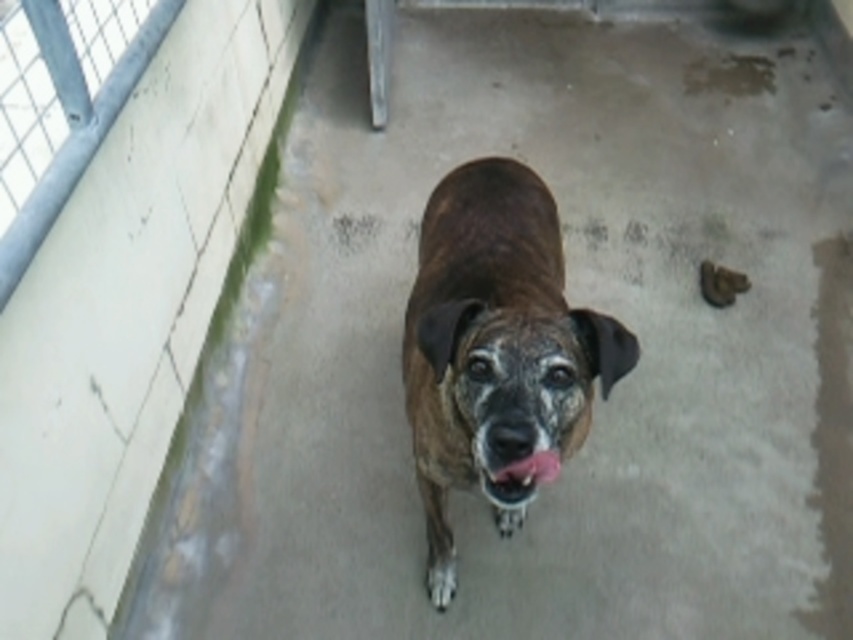
Question: Which point appears farthest from the camera in this image?

Choices:
 (A) (509, 465)
 (B) (421, 374)

Answer: (B)

Question: Which of the following is the closest to the observer?

Choices:
 (A) brown fur dog at center
 (B) pink glossy tongue at center

Answer: (A)

Question: Can you confirm if brown fur dog at center is thinner than pink glossy tongue at center?

Choices:
 (A) no
 (B) yes

Answer: (A)

Question: Can you confirm if brown fur dog at center is positioned to the left of pink glossy tongue at center?

Choices:
 (A) no
 (B) yes

Answer: (B)

Question: Does brown fur dog at center appear on the left side of pink glossy tongue at center?

Choices:
 (A) no
 (B) yes

Answer: (B)